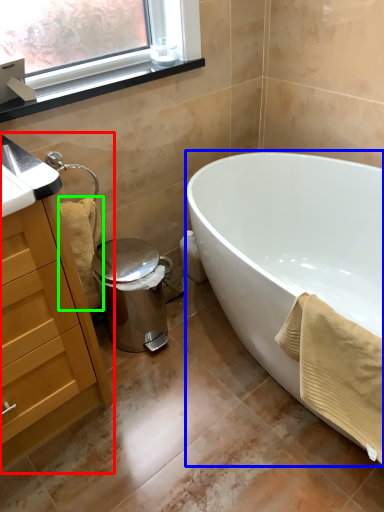
Question: Which object is positioned farthest from cabinetry (highlighted by a red box)? Select from bathtub (highlighted by a blue box) and bath towel (highlighted by a green box).

Choices:
 (A) bathtub
 (B) bath towel

Answer: (A)